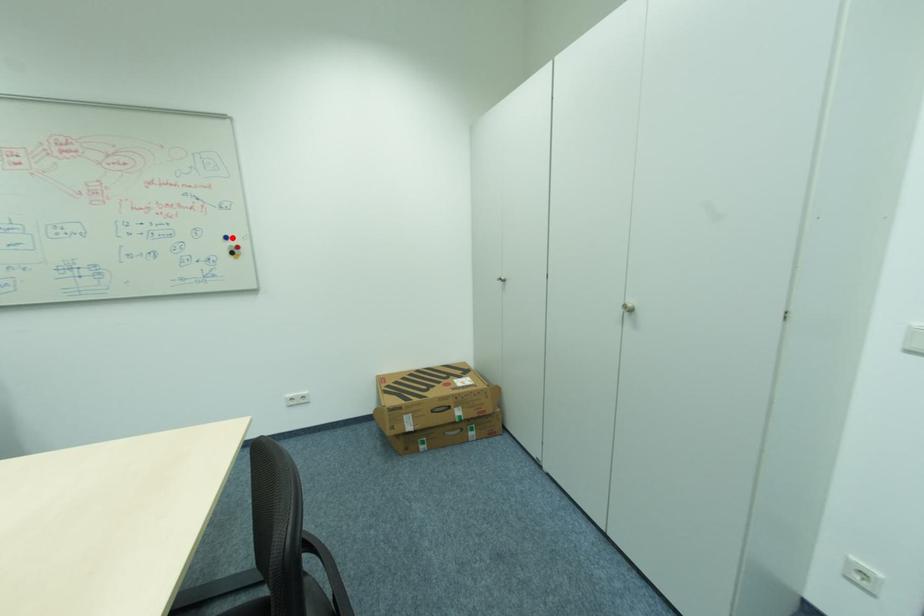
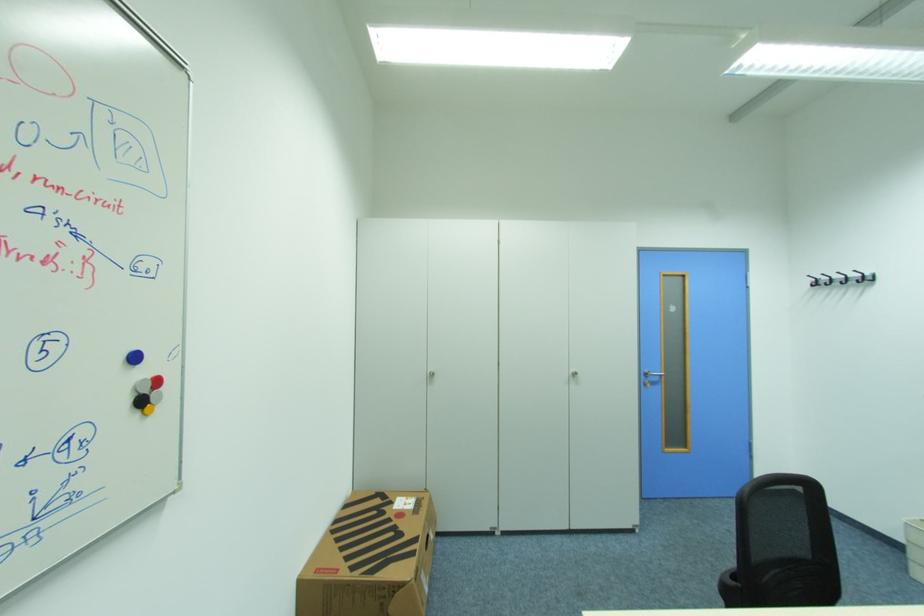
In the second image, find the point that corresponds to the highlighted location in the first image.

(140, 359)